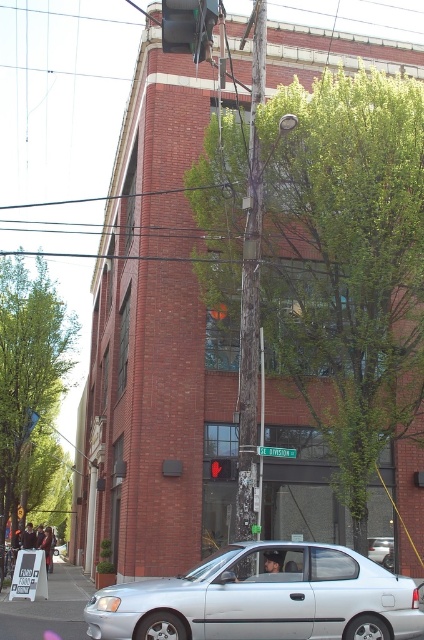
Is silver metallic car at lower center in front of silver metallic car at center?

Yes.

Is silver metallic car at lower center below silver metallic car at center?

Actually, silver metallic car at lower center is above silver metallic car at center.

Who is more forward, [181,612] or [390,550]?

Point [181,612] is in front.

Image resolution: width=424 pixels, height=640 pixels. What are the coordinates of `silver metallic car at lower center` in the screenshot? It's located at (262, 598).

Which is behind, point (190, 4) or point (392, 544)?

The point (392, 544) is behind.

Is the position of metallic red traffic light at upper center less distant than that of silver metallic car at center?

Yes, it is.

Which is behind, point (187, 38) or point (384, 566)?

The point (384, 566) is behind.

Locate an element on the screen. Image resolution: width=424 pixels, height=640 pixels. metallic red traffic light at upper center is located at coordinates (189, 26).

Looking at this image, can you confirm if silver metallic car at lower center is wider than metallic red traffic light at upper center?

Yes.

Is silver metallic car at lower center further to camera compared to metallic red traffic light at upper center?

Yes.

Who is more distant from viewer, (310, 563) or (194, 60)?

The point (194, 60) is behind.

Image resolution: width=424 pixels, height=640 pixels. What are the coordinates of `silver metallic car at lower center` in the screenshot? It's located at (262, 598).